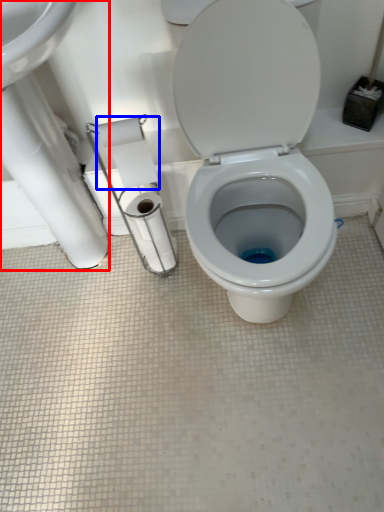
Question: Which point is further to the camera, sink (highlighted by a red box) or toilet paper (highlighted by a blue box)?

Choices:
 (A) sink
 (B) toilet paper

Answer: (B)